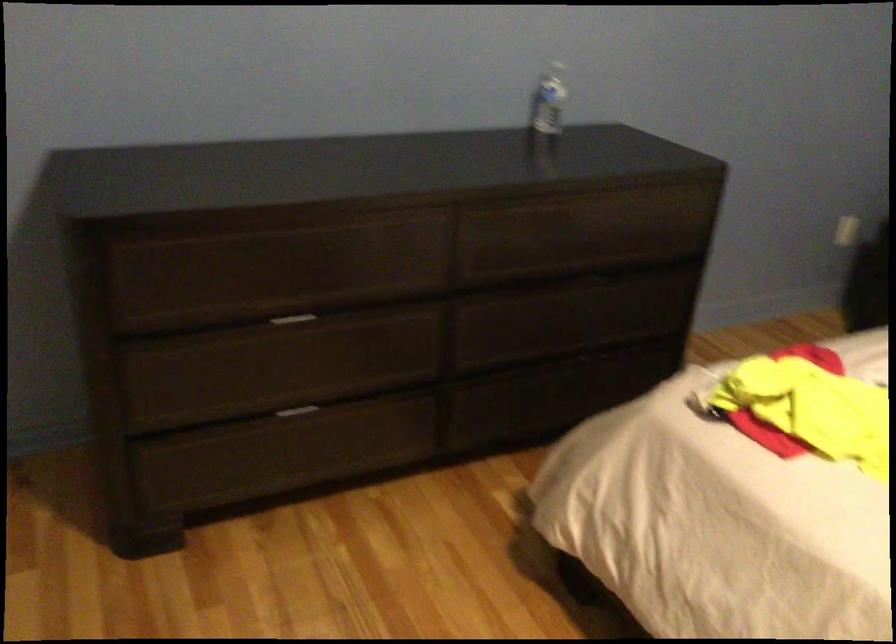
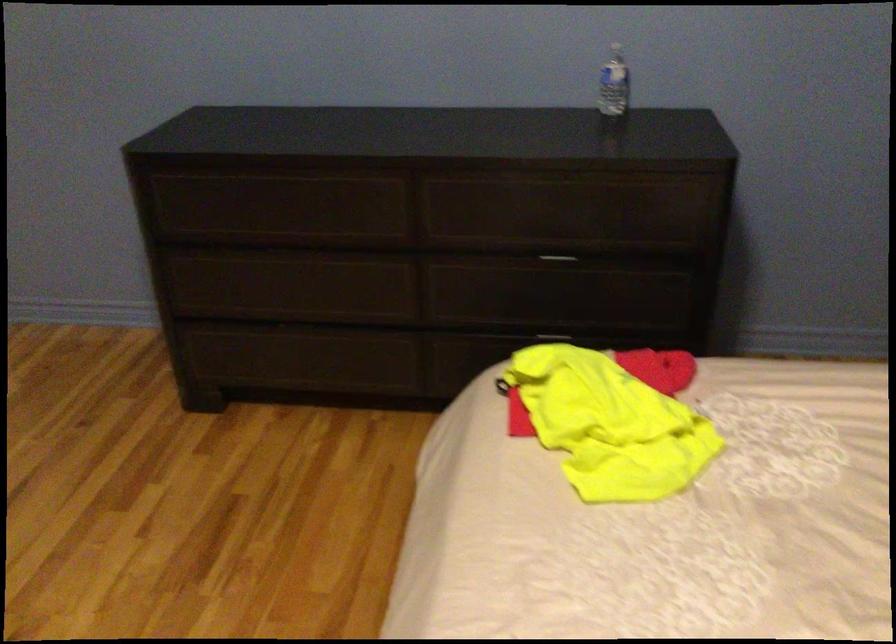
Find the pixel in the second image that matches (575,354) in the first image.

(553, 333)